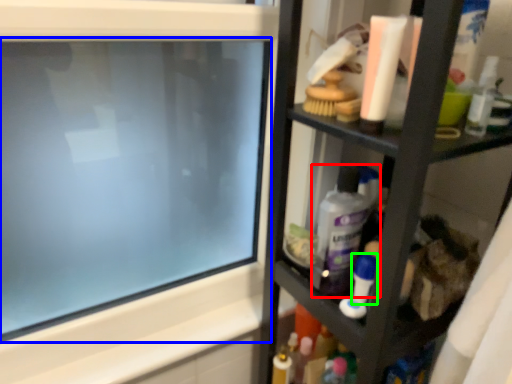
Question: Which is nearer to the cleaning product (highlighted by a red box)? computer screen (highlighted by a blue box) or toiletry (highlighted by a green box).

Choices:
 (A) computer screen
 (B) toiletry

Answer: (B)